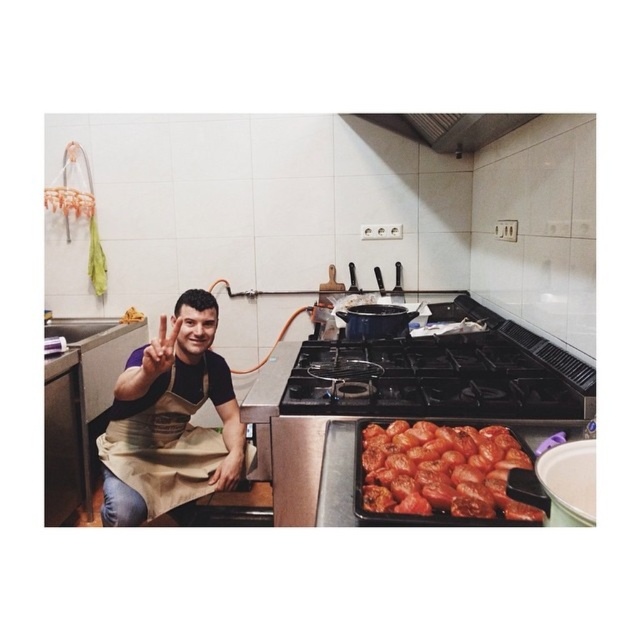
From the picture: You are a chef standing in front of the kitchen counter. You need to reach for the metallic at upper center to stir a pot. Is the beige apron at center in your way?

The beige apron at center is closer to the viewer than the metallic at upper center, so the beige apron at center is blocking the path to the metallic at upper center. You would need to move the beige apron at center out of the way first.

You are a chef preparing a dish and need to know which item is more suitable for slicing vegetables. Based on their thickness, which object between the shiny red tomatoes at center and the metallic at upper center would you choose?

The shiny red tomatoes at center is thinner than the metallic at upper center, so the shiny red tomatoes at center would be more suitable for slicing vegetables.